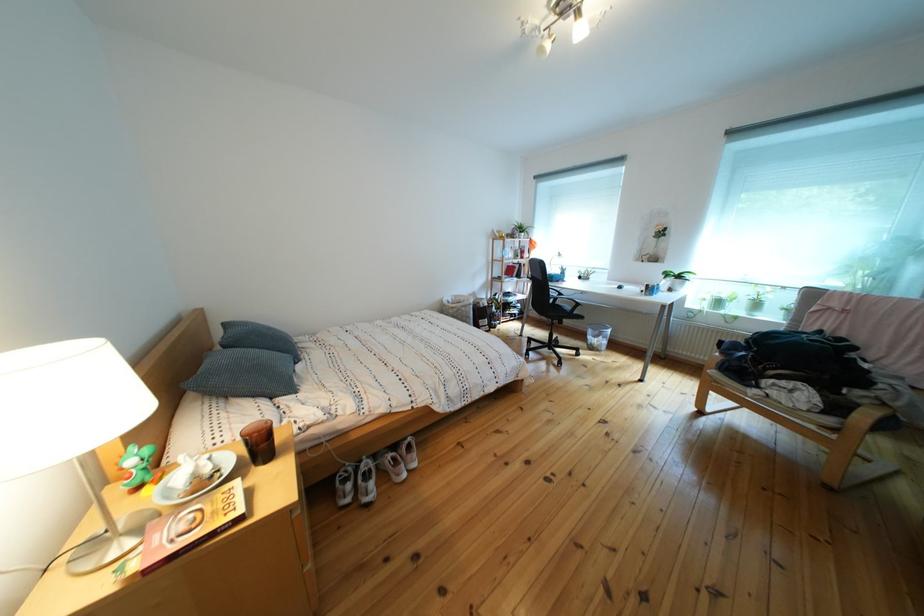
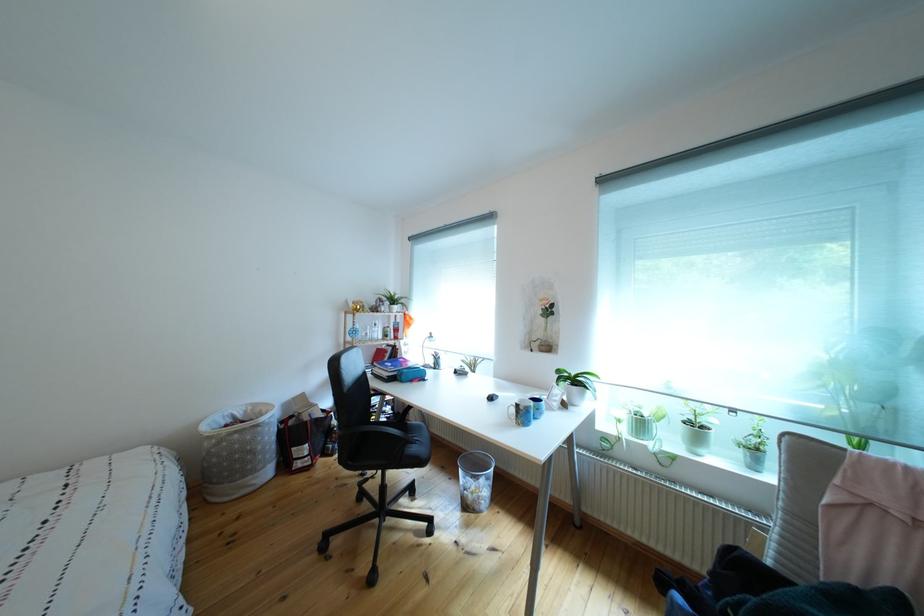
The point at (505, 315) is marked in the first image. Where is the corresponding point in the second image?

(346, 428)